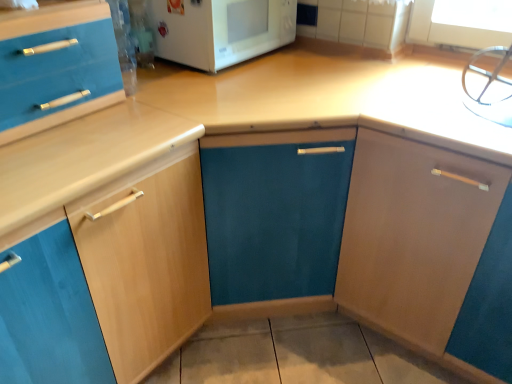
Question: Is white glossy microwave at upper center situated inside light wood cabinet at left, the 1th cabinetry positioned from the left, or outside?

Choices:
 (A) outside
 (B) inside

Answer: (A)

Question: From a real-world perspective, is white glossy microwave at upper center above or below light wood cabinet at left, the 1th cabinetry positioned from the left?

Choices:
 (A) above
 (B) below

Answer: (A)

Question: Estimate the real-world distances between objects in this image. Which object is farther from the white glossy microwave at upper center?

Choices:
 (A) matte wood cabinet at right, the second cabinetry viewed from the left
 (B) light wood cabinet at left, the 1th cabinetry positioned from the left

Answer: (A)

Question: Estimate the real-world distances between objects in this image. Which object is farther from the white glossy microwave at upper center?

Choices:
 (A) matte wood cabinet at right, which appears as the first cabinetry when viewed from the right
 (B) light wood cabinet at left, arranged as the 2th cabinetry when viewed from the right

Answer: (A)